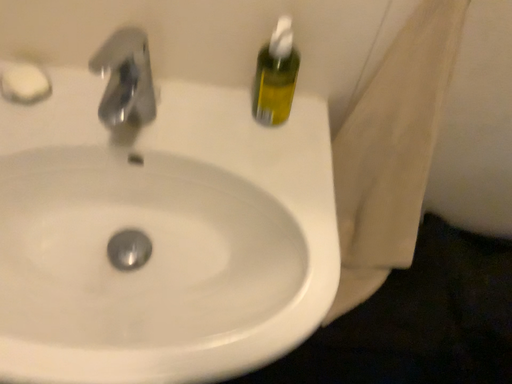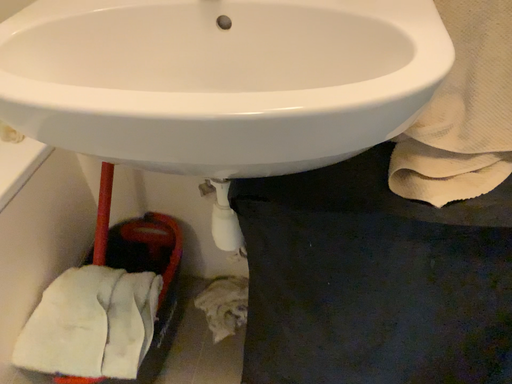
Question: Which way did the camera rotate in the video?

Choices:
 (A) rotated left
 (B) rotated right

Answer: (A)